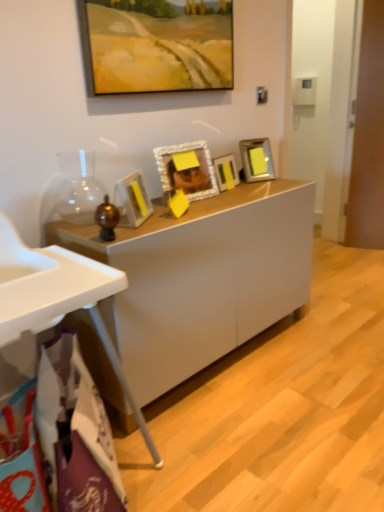
Question: Does white glossy cabinet at center contain white plastic high chair at lower left?

Choices:
 (A) yes
 (B) no

Answer: (B)

Question: Considering the relative sizes of white glossy cabinet at center and white plastic high chair at lower left in the image provided, is white glossy cabinet at center taller than white plastic high chair at lower left?

Choices:
 (A) yes
 (B) no

Answer: (B)

Question: Considering the relative sizes of white glossy cabinet at center and white plastic high chair at lower left in the image provided, is white glossy cabinet at center bigger than white plastic high chair at lower left?

Choices:
 (A) no
 (B) yes

Answer: (B)

Question: Considering the relative sizes of white glossy cabinet at center and white plastic high chair at lower left in the image provided, is white glossy cabinet at center shorter than white plastic high chair at lower left?

Choices:
 (A) no
 (B) yes

Answer: (B)

Question: Considering the relative positions of white glossy cabinet at center and white plastic high chair at lower left in the image provided, is white glossy cabinet at center behind white plastic high chair at lower left?

Choices:
 (A) yes
 (B) no

Answer: (A)

Question: Is point (51, 287) closer or farther from the camera than point (213, 185)?

Choices:
 (A) farther
 (B) closer

Answer: (B)

Question: Looking at their shapes, would you say white plastic high chair at lower left is wider or thinner than white textured picture frame at center, which ranks as the second picture frame in bottom-to-top order?

Choices:
 (A) thin
 (B) wide

Answer: (B)

Question: Do you think white plastic high chair at lower left is within white textured picture frame at center, placed as the 4th picture frame when sorted from top to bottom, or outside of it?

Choices:
 (A) outside
 (B) inside

Answer: (A)

Question: From the image's perspective, is white plastic high chair at lower left located above or below white textured picture frame at center, placed as the 4th picture frame when sorted from top to bottom?

Choices:
 (A) above
 (B) below

Answer: (B)

Question: From the image's perspective, is matte yellow picture frame at center, which is the first picture frame in bottom-to-top order, positioned above or below metallic silver picture frame at center-right, acting as the 4th picture frame starting from the bottom?

Choices:
 (A) above
 (B) below

Answer: (B)

Question: From a real-world perspective, is matte yellow picture frame at center, which appears as the 5th picture frame when viewed from the top, physically located above or below metallic silver picture frame at center-right, acting as the 4th picture frame starting from the bottom?

Choices:
 (A) below
 (B) above

Answer: (A)

Question: Is matte yellow picture frame at center, which is the first picture frame in bottom-to-top order, wider or thinner than metallic silver picture frame at center-right, acting as the 4th picture frame starting from the bottom?

Choices:
 (A) thin
 (B) wide

Answer: (B)

Question: Is matte yellow picture frame at center, which is the first picture frame in bottom-to-top order, inside the boundaries of metallic silver picture frame at center-right, acting as the 4th picture frame starting from the bottom, or outside?

Choices:
 (A) inside
 (B) outside

Answer: (B)

Question: In terms of width, does metallic silver picture frame at center-right, acting as the 2th picture frame starting from the top, look wider or thinner when compared to matte yellow picture frame at center, which is the first picture frame in bottom-to-top order?

Choices:
 (A) thin
 (B) wide

Answer: (A)

Question: Looking at the image, does metallic silver picture frame at center-right, acting as the 2th picture frame starting from the top, seem bigger or smaller compared to matte yellow picture frame at center, which appears as the 5th picture frame when viewed from the top?

Choices:
 (A) big
 (B) small

Answer: (B)